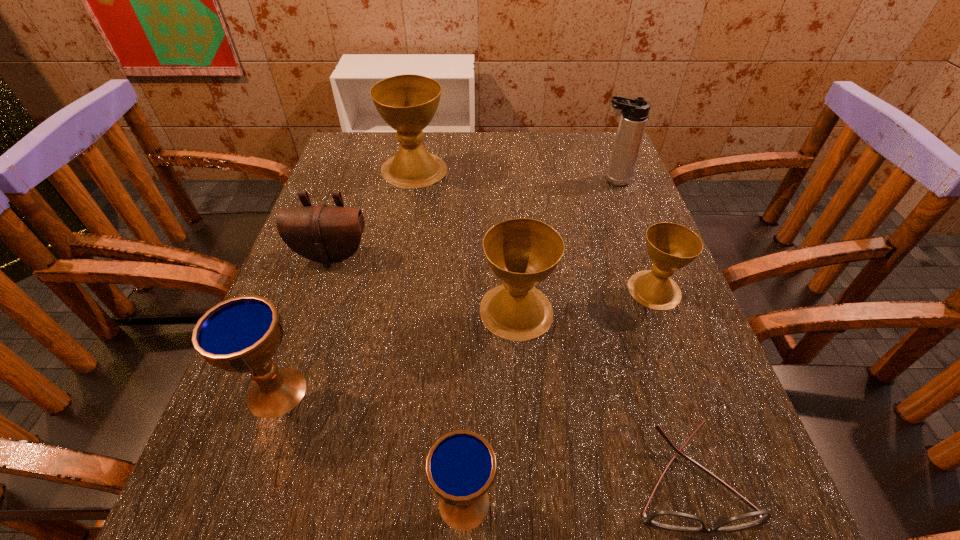
I want to click on vacant space located 0.080m on the back of the rightmost brown chalice, so click(x=637, y=245).

The height and width of the screenshot is (540, 960). I want to click on vacant space located 0.350m on the right of the nearest chalice, so click(x=746, y=503).

In order to click on chalice that is at the far edge in this screenshot , I will do (407, 103).

Identify the location of thermos bottle present at the far edge. (634, 112).

The width and height of the screenshot is (960, 540). In order to click on chalice at the near edge in this screenshot , I will do `click(461, 466)`.

The width and height of the screenshot is (960, 540). I want to click on spectacles at the near edge, so click(x=672, y=520).

Where is `pouch situated at the left edge`? The height and width of the screenshot is (540, 960). pouch situated at the left edge is located at coordinates 324,234.

Identify the location of thermos bottle positioned at the right edge. Image resolution: width=960 pixels, height=540 pixels. (634, 112).

Find the location of a particular element. chalice positioned at the right edge is located at coordinates (670, 246).

Where is `spectacles that is at the right edge`? spectacles that is at the right edge is located at coordinates (672, 520).